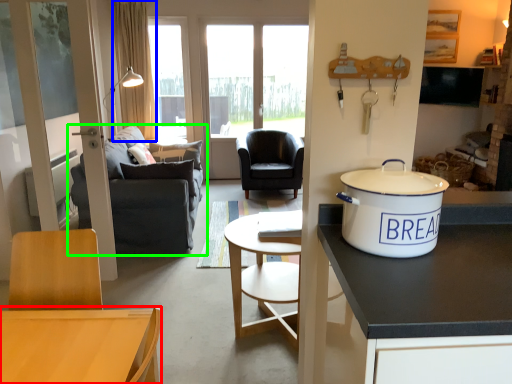
Question: Which object is the farthest from desk (highlighted by a red box)? Choose among these: curtain (highlighted by a blue box) or studio couch (highlighted by a green box).

Choices:
 (A) curtain
 (B) studio couch

Answer: (A)